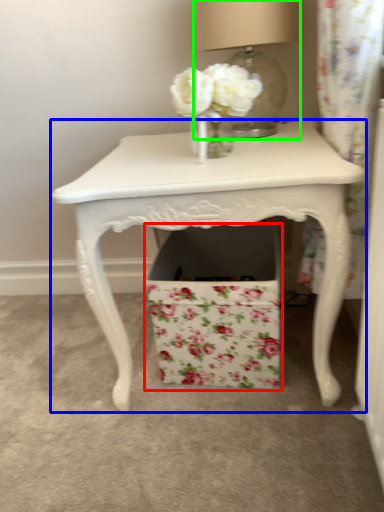
Question: Based on their relative distances, which object is nearer to cardboard box (highlighted by a red box)? Choose from table (highlighted by a blue box) and table lamp (highlighted by a green box).

Choices:
 (A) table
 (B) table lamp

Answer: (A)